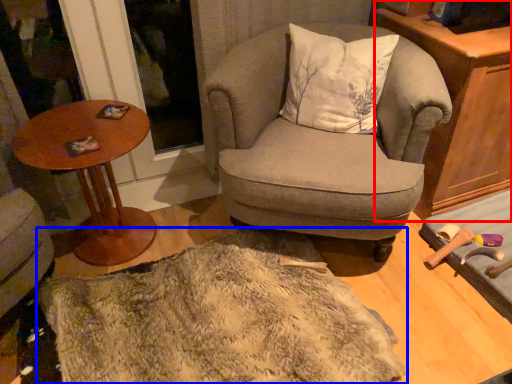
Question: Which point is closer to the camera, cabinetry (highlighted by a red box) or blanket (highlighted by a blue box)?

Choices:
 (A) cabinetry
 (B) blanket

Answer: (B)